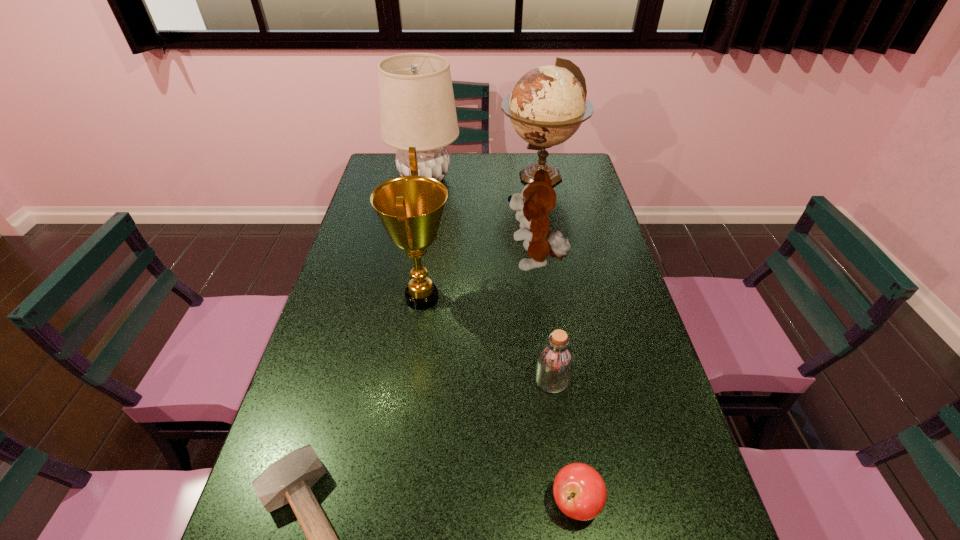
Find the location of a particular element. free space located 0.060m on the left of the lampshade is located at coordinates (373, 179).

The image size is (960, 540). Find the location of `free point located on the front view with handles of the award`. free point located on the front view with handles of the award is located at coordinates click(x=481, y=298).

This screenshot has width=960, height=540. In order to click on free location located 0.120m on the face of the puppy in this screenshot , I will do (467, 262).

Where is `vacant area situated on the face of the puppy`? This screenshot has width=960, height=540. vacant area situated on the face of the puppy is located at coordinates (473, 262).

Locate an element on the screen. This screenshot has height=540, width=960. vacant space located on the face of the puppy is located at coordinates (489, 262).

At what (x,y) coordinates should I click in order to perform the action: click on free location located on the left of the bottle. Please return your answer as a coordinate pair (x, y). This screenshot has width=960, height=540. Looking at the image, I should click on (376, 379).

I want to click on free spot located 0.080m on the back of the sixth tallest object, so coord(566,439).

At what (x,y) coordinates should I click in order to perform the action: click on globe positioned at the far edge. Please return your answer as a coordinate pair (x, y). Looking at the image, I should click on (548, 104).

Identify the location of lampshade located at the far edge. Image resolution: width=960 pixels, height=540 pixels. (417, 108).

Find the location of a particular element. Image resolution: width=960 pixels, height=540 pixels. object located in the left edge section of the desktop is located at coordinates (417, 108).